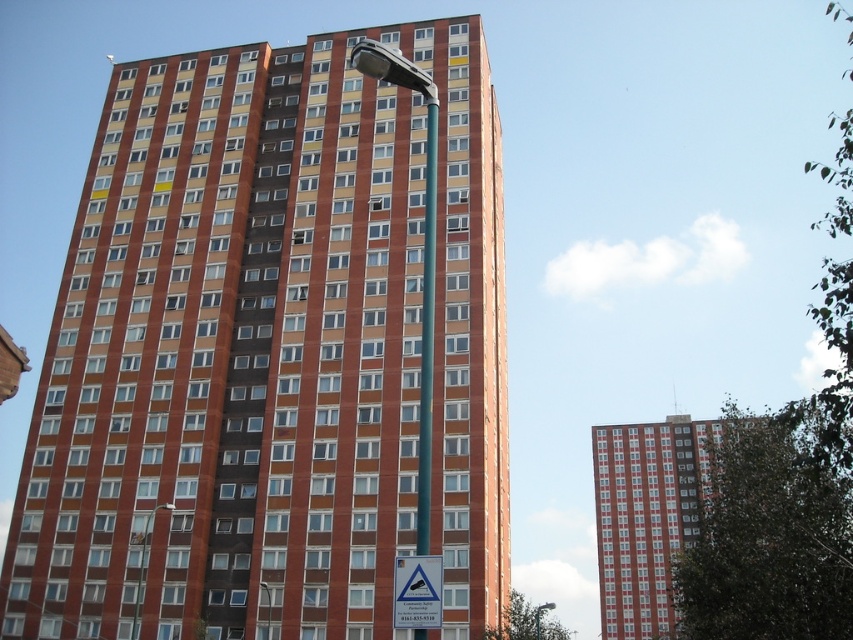
Question: Which of the following is the farthest from the observer?

Choices:
 (A) green metallic pole at center
 (B) brick textured building at center
 (C) brick building at center
 (D) white plastic triangle at lower center

Answer: (C)

Question: Which point is farther to the camera?

Choices:
 (A) 612,477
 (B) 265,177
 (C) 428,577
 (D) 419,413

Answer: (A)

Question: Can you confirm if brick textured building at center is positioned to the left of green metallic pole at center?

Choices:
 (A) no
 (B) yes

Answer: (A)

Question: Does brick textured building at center have a smaller size compared to white plastic triangle at lower center?

Choices:
 (A) yes
 (B) no

Answer: (B)

Question: Which object is farther from the camera taking this photo?

Choices:
 (A) green metallic pole at center
 (B) brick textured building at center

Answer: (B)

Question: Does brick building at center appear under white plastic triangle at lower center?

Choices:
 (A) no
 (B) yes

Answer: (A)